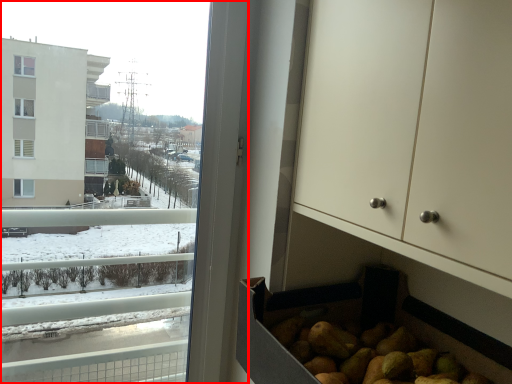
Question: From the image's perspective, where is window (annotated by the red box) located in relation to dresser in the image?

Choices:
 (A) above
 (B) below

Answer: (B)